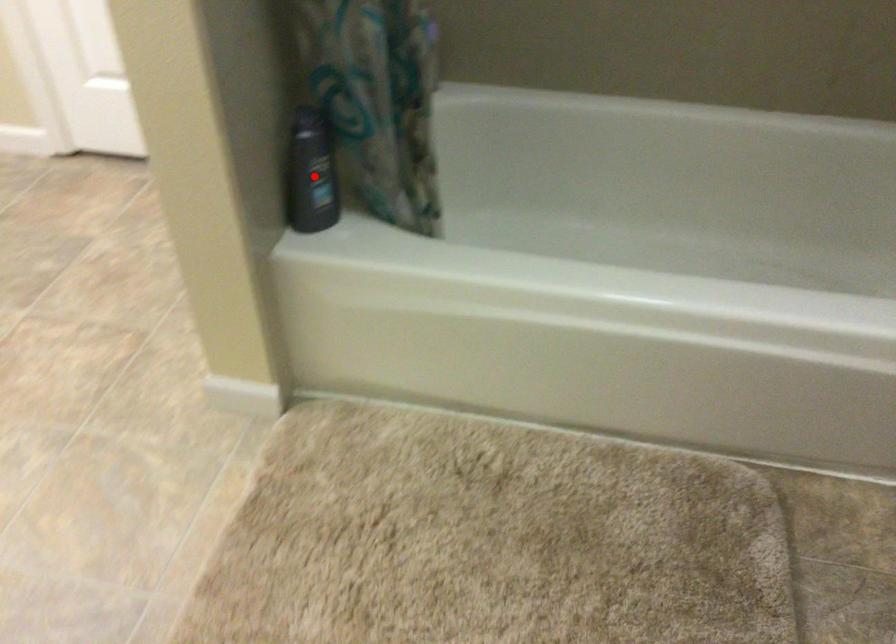
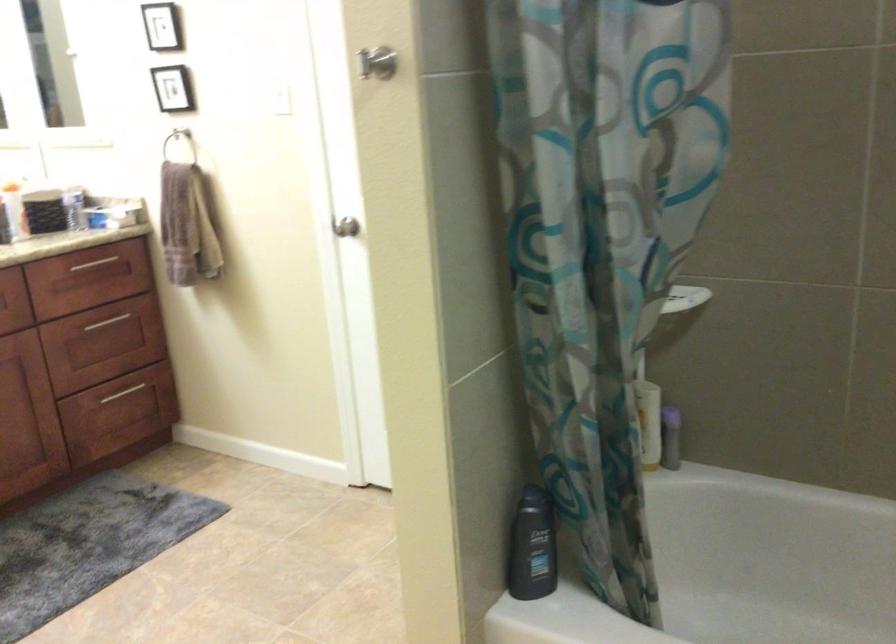
Question: I am providing you with two images of the same scene from different viewpoints. Given a red point in image1, look at the same physical point in image2. Is it:

Choices:
 (A) Closer to the viewpoint
 (B) Farther from the viewpoint

Answer: (B)